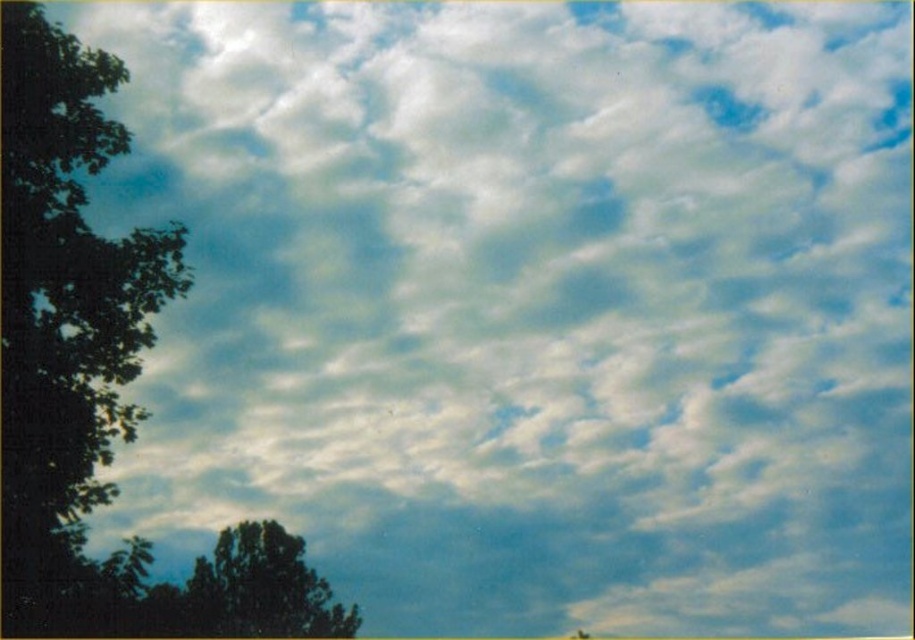
The height and width of the screenshot is (640, 915). I want to click on green leafy tree at left, so click(x=65, y=324).